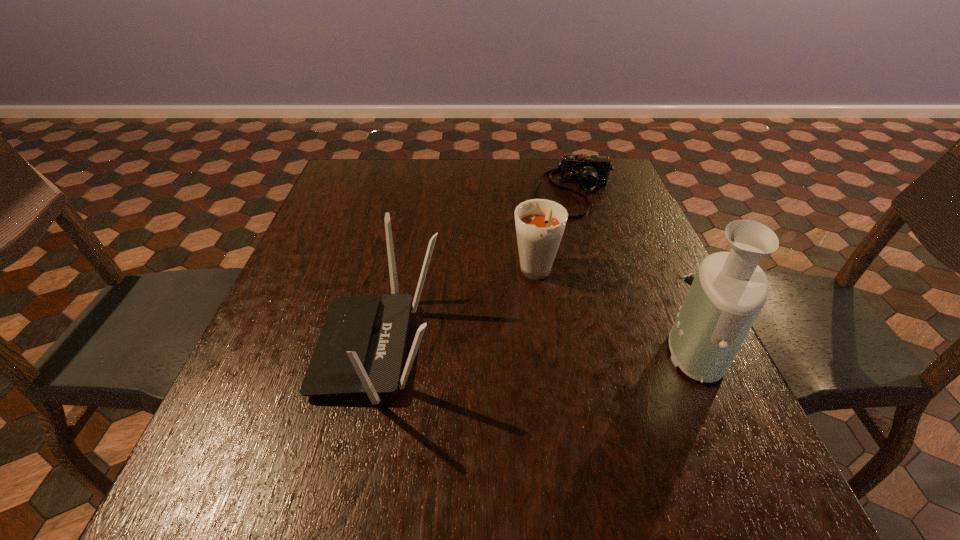
I want to click on vacant space situated 0.080m on the front-facing side of the camera, so click(575, 237).

You are a GUI agent. You are given a task and a screenshot of the screen. Output one action in this format:
    pyautogui.click(x=<x>, y=<y>)
    Task: Click on the free space located 0.100m on the front-facing side of the camera
    This screenshot has height=540, width=960.
    Given the screenshot: What is the action you would take?
    pyautogui.click(x=575, y=241)

Identify the location of free space located 0.120m on the drink side of the root beer. The image size is (960, 540). [x=522, y=338].

You are a GUI agent. You are given a task and a screenshot of the screen. Output one action in this format:
    pyautogui.click(x=<x>, y=<y>)
    Task: Click on the free space located on the drink side of the root beer
    
    Given the screenshot: What is the action you would take?
    pyautogui.click(x=502, y=421)

Where is `vacant space located 0.270m on the drink side of the root beer`? Image resolution: width=960 pixels, height=540 pixels. vacant space located 0.270m on the drink side of the root beer is located at coordinates (507, 401).

The image size is (960, 540). In order to click on object situated at the far edge in this screenshot , I will do `click(588, 171)`.

You are a GUI agent. You are given a task and a screenshot of the screen. Output one action in this format:
    pyautogui.click(x=<x>, y=<y>)
    Task: Click on the object present at the near edge
    This screenshot has height=540, width=960.
    Given the screenshot: What is the action you would take?
    pyautogui.click(x=360, y=348)

Image resolution: width=960 pixels, height=540 pixels. What are the coordinates of `object positioned at the left edge` in the screenshot? It's located at (360, 348).

Find the location of a particular element. The image size is (960, 540). juicer that is at the right edge is located at coordinates (729, 290).

Locate an element on the screen. Image resolution: width=960 pixels, height=540 pixels. camera situated at the right edge is located at coordinates (588, 171).